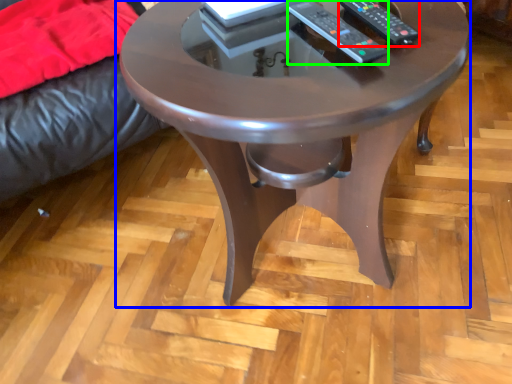
Question: Which object is positioned closest to remote (highlighted by a red box)? Select from coffee table (highlighted by a blue box) and remote (highlighted by a green box).

Choices:
 (A) coffee table
 (B) remote

Answer: (B)